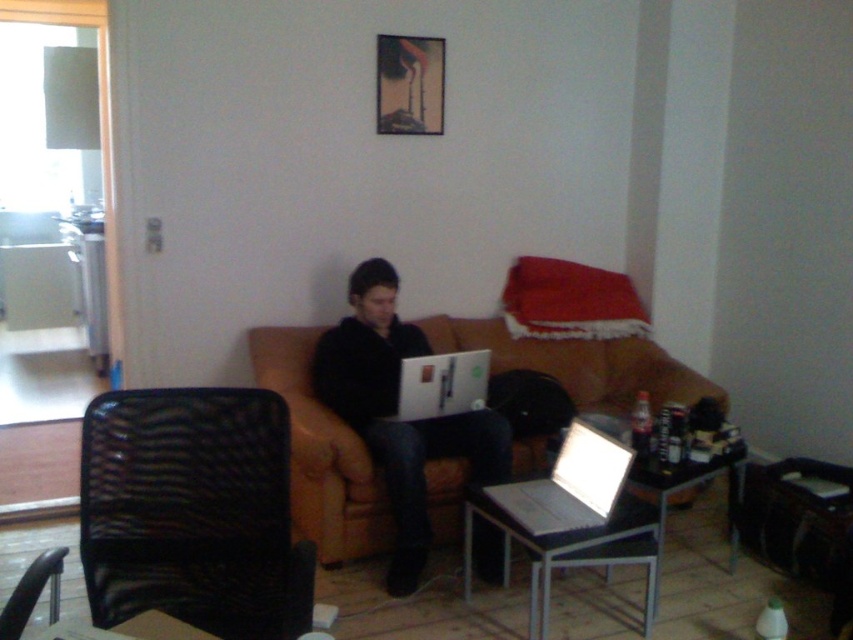
You are a delivery person who needs to deliver two identical laptops to the living room shown. The first laptop must be placed exactly where the black matte laptop at center is currently located, and the second one where the matte black laptop at center is. However, you realize that the space might be limited. Based on the scene description, can both laptops fit in their designated spots without overlapping?

The black matte laptop at center is larger in size than the matte black laptop at center. Since the first laptop needs to be placed where the larger one is located, there should be enough space as the existing placement accommodates its size. The second spot where the smaller matte black laptop at center is placed should also have sufficient space for the second laptop. Both laptops can fit without overlapping.

You are trying to locate two identical laptops in the living room. According to the scene, where exactly are the black matte laptop at center and the matte black laptop at center positioned relative to each other?

The black matte laptop at center is to the left of the matte black laptop at center.